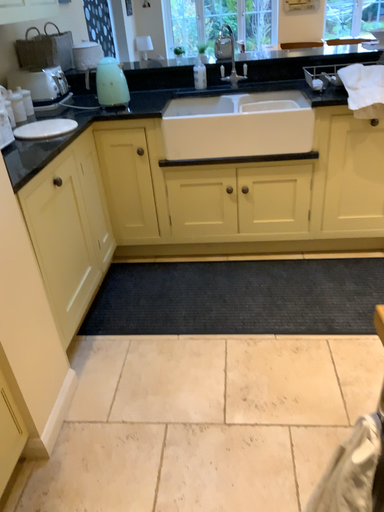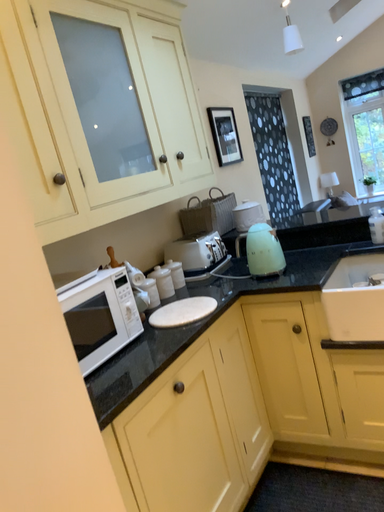
Question: How did the camera likely rotate when shooting the video?

Choices:
 (A) rotated upward
 (B) rotated downward

Answer: (A)